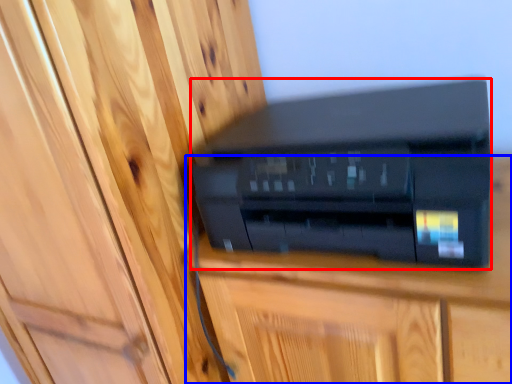
Question: Which object is closer to the camera taking this photo, printer (highlighted by a red box) or furniture (highlighted by a blue box)?

Choices:
 (A) printer
 (B) furniture

Answer: (A)